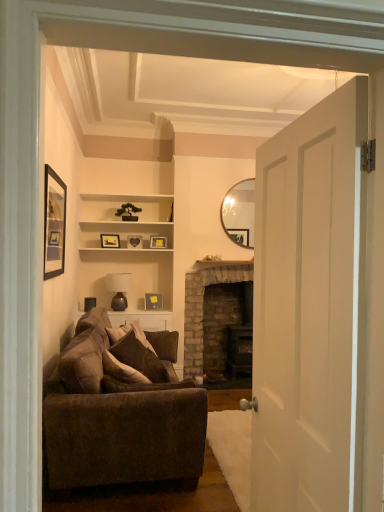
Question: Are wooden heart at center, which is the 3th picture frame in front-to-back order, and black matte picture frame at upper left, positioned as the 1th picture frame in top-to-bottom order, far apart?

Choices:
 (A) yes
 (B) no

Answer: (A)

Question: Is wooden heart at center, the third picture frame positioned from the back, thinner than black matte picture frame at upper left, the fifth picture frame in the bottom-to-top sequence?

Choices:
 (A) no
 (B) yes

Answer: (A)

Question: Does wooden heart at center, which is counted as the fourth picture frame, starting from the bottom, come in front of black matte picture frame at upper left, which is counted as the fifth picture frame, starting from the back?

Choices:
 (A) yes
 (B) no

Answer: (B)

Question: Considering the relative positions of wooden heart at center, which is the 3th picture frame in front-to-back order, and black matte picture frame at upper left, positioned as the 1th picture frame in top-to-bottom order, in the image provided, is wooden heart at center, which is the 3th picture frame in front-to-back order, behind black matte picture frame at upper left, positioned as the 1th picture frame in top-to-bottom order,?

Choices:
 (A) no
 (B) yes

Answer: (B)

Question: From a real-world perspective, is wooden heart at center, placed as the second picture frame when sorted from top to bottom, located beneath black matte picture frame at upper left, the fifth picture frame in the bottom-to-top sequence?

Choices:
 (A) no
 (B) yes

Answer: (B)

Question: Can you confirm if wooden heart at center, which is counted as the fourth picture frame, starting from the bottom, is taller than black matte picture frame at upper left, the fifth picture frame in the bottom-to-top sequence?

Choices:
 (A) no
 (B) yes

Answer: (A)

Question: Can you confirm if wooden heart at center, which is counted as the fourth picture frame, starting from the bottom, is shorter than brown suede pillow at center?

Choices:
 (A) no
 (B) yes

Answer: (B)

Question: From a real-world perspective, is wooden heart at center, placed as the second picture frame when sorted from top to bottom, under brown suede pillow at center?

Choices:
 (A) yes
 (B) no

Answer: (B)

Question: Can you confirm if wooden heart at center, placed as the second picture frame when sorted from top to bottom, is wider than brown suede pillow at center?

Choices:
 (A) no
 (B) yes

Answer: (A)

Question: From the image's perspective, is wooden heart at center, the third picture frame positioned from the back, below brown suede pillow at center?

Choices:
 (A) yes
 (B) no

Answer: (B)

Question: Is wooden heart at center, the third picture frame positioned from the back, positioned with its back to brown suede pillow at center?

Choices:
 (A) no
 (B) yes

Answer: (A)

Question: Can you confirm if wooden heart at center, the third picture frame positioned from the back, is taller than brown suede pillow at center?

Choices:
 (A) no
 (B) yes

Answer: (A)

Question: Considering the relative sizes of matte brown lamp at center and black matte picture frame at upper left, positioned as the 1th picture frame in top-to-bottom order, in the image provided, is matte brown lamp at center wider than black matte picture frame at upper left, positioned as the 1th picture frame in top-to-bottom order,?

Choices:
 (A) no
 (B) yes

Answer: (B)